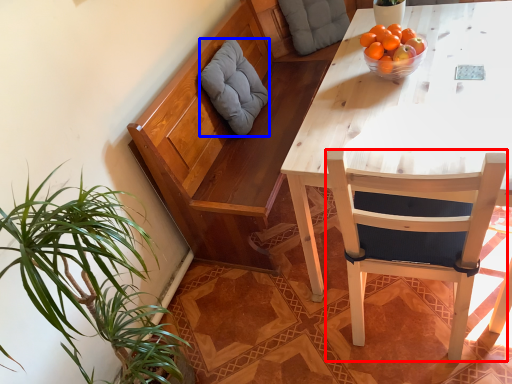
Question: Which object is closer to the camera taking this photo, chair (highlighted by a red box) or pillow (highlighted by a blue box)?

Choices:
 (A) chair
 (B) pillow

Answer: (A)